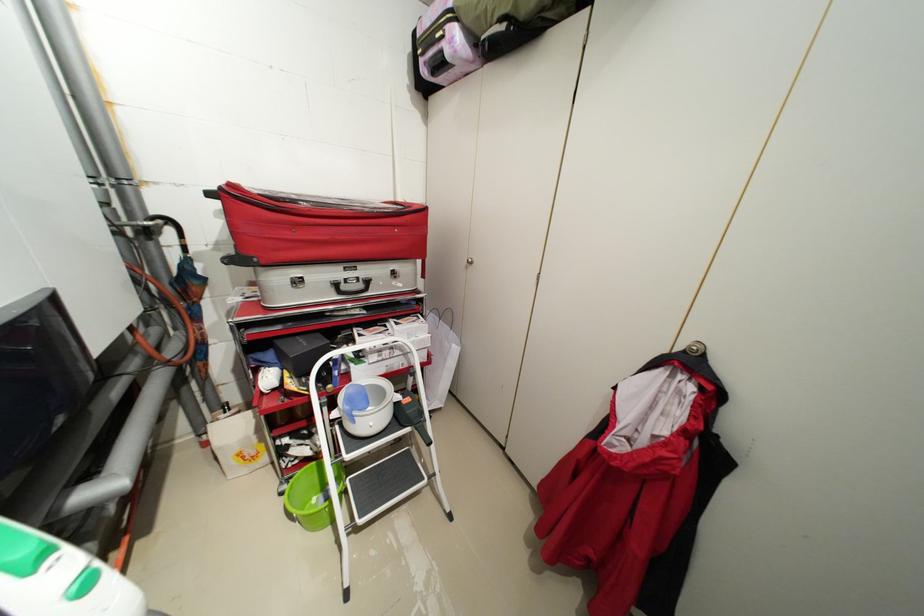
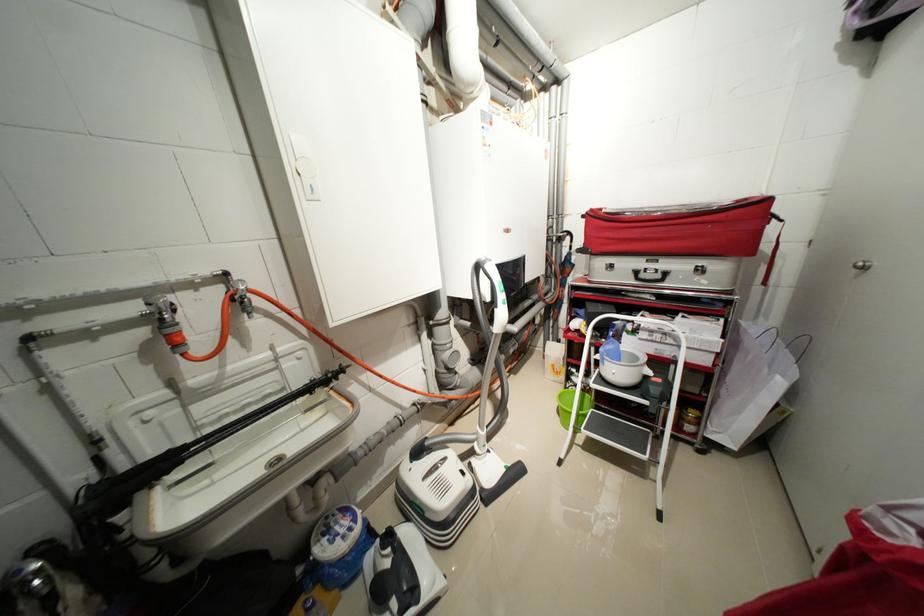
The point at (463, 350) is marked in the first image. Where is the corresponding point in the second image?

(787, 384)